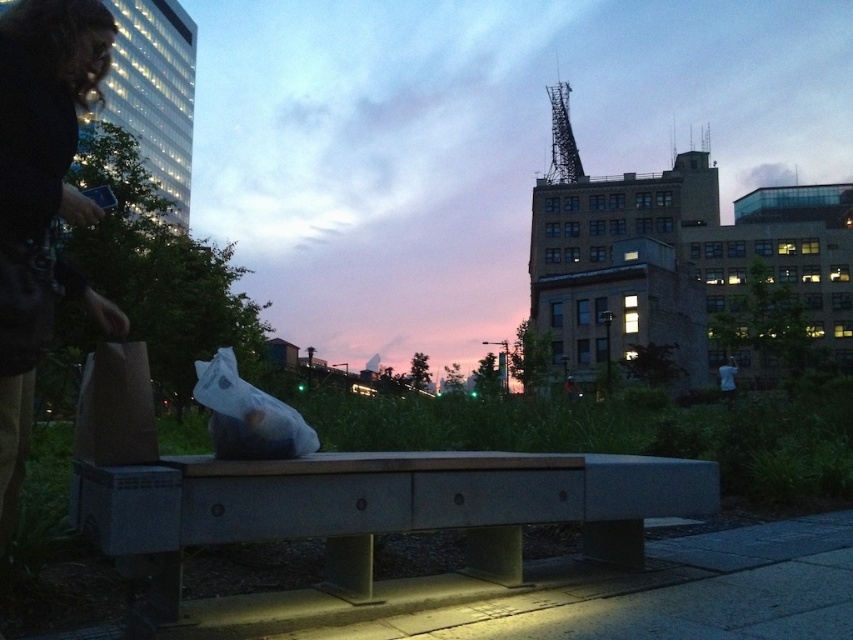
Which is in front, point (346, 460) or point (579, 177)?

Point (346, 460)

Who is shorter, concrete bench at center or metallic structure at upper right?

concrete bench at center is shorter.

Identify the location of concrete bench at center. (380, 508).

Where is `concrete bench at center`? The image size is (853, 640). concrete bench at center is located at coordinates (380, 508).